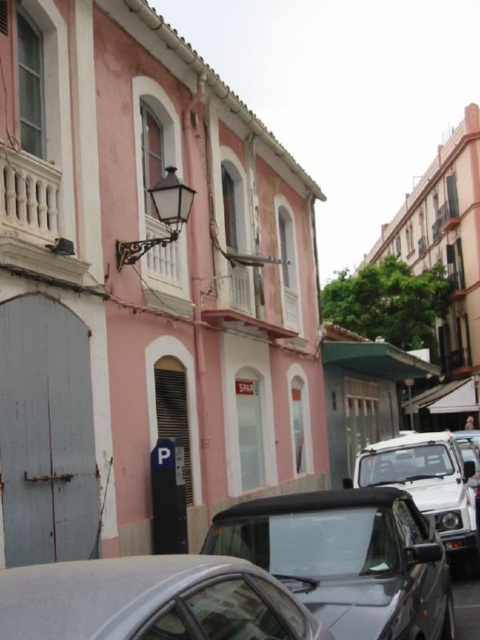
You are a delivery person with a cart that is 5 feet wide. You need to navigate between the black matte car at lower center and the satin silver car at lower center. Can your cart fit through the space between them?

The black matte car at lower center and satin silver car at lower center are 4.96 feet apart. Since your cart is 5 feet wide, it cannot fit through the space between them as the gap is slightly narrower than the cart.

You are a delivery person trying to park your van between the black matte car at lower center and the satin silver car at lower center. Can you fit your van, which is 6 meters long, in the space between them?

The black matte car at lower center is bigger than the satin silver car at lower center, but the exact distance between them isn t provided. Without knowing the space between the two cars, it s impossible to determine if the van will fit.

You are a pedestrian standing on the sidewalk next to the pink building and want to cross the street to reach the gray garage door. There are two cars in your path. Which car is closer to the pink building, the black matte car at lower center or the metallic silver car at center?

The black matte car at lower center is positioned on the left side of the metallic silver car at center, so the black matte car at lower center is closer to the pink building.